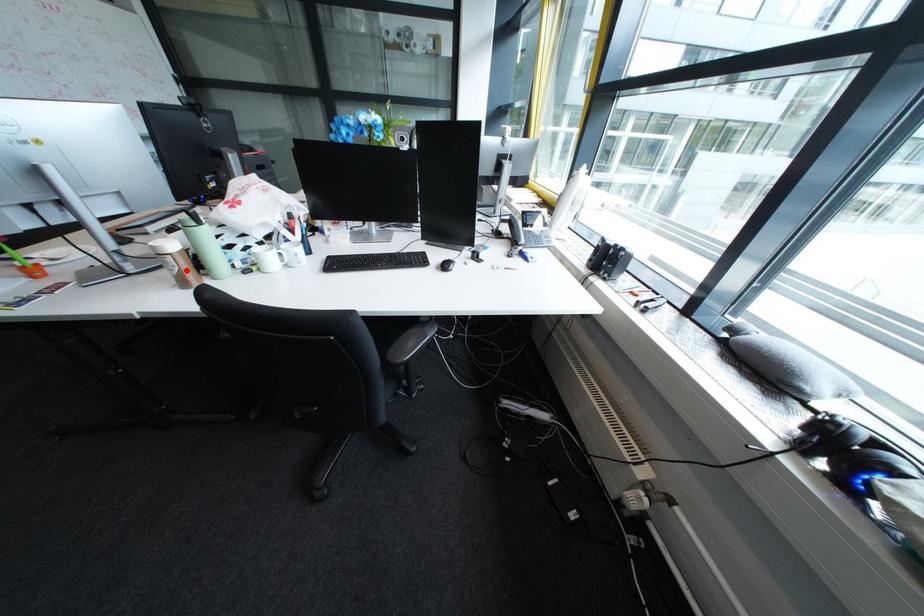
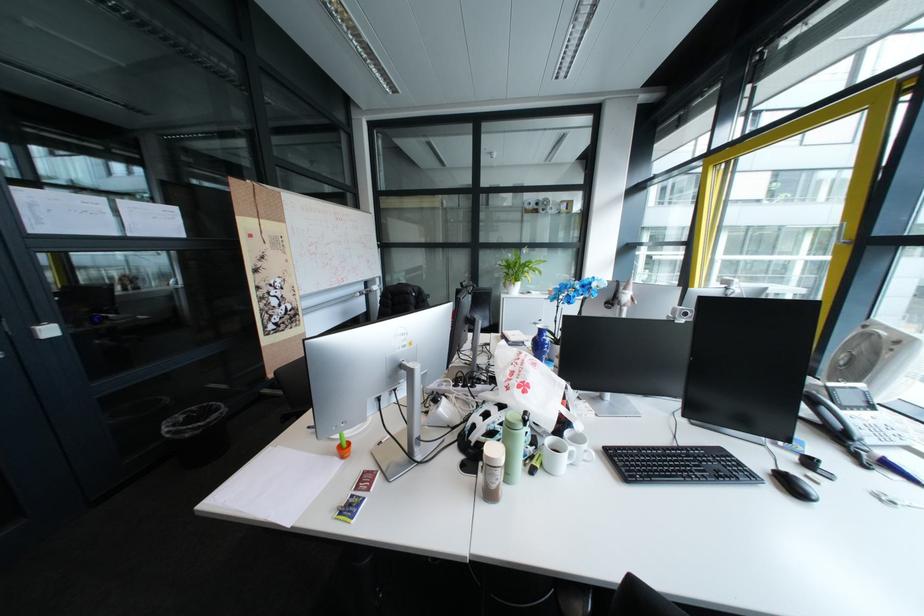
The point at the highlighted location is marked in the first image. Where is the corresponding point in the second image?

(507, 484)